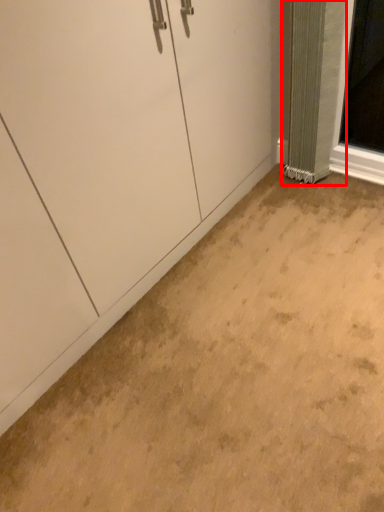
Question: From the image's perspective, what is the correct spatial positioning of curtain (annotated by the red box) in reference to concrete?

Choices:
 (A) above
 (B) below

Answer: (A)